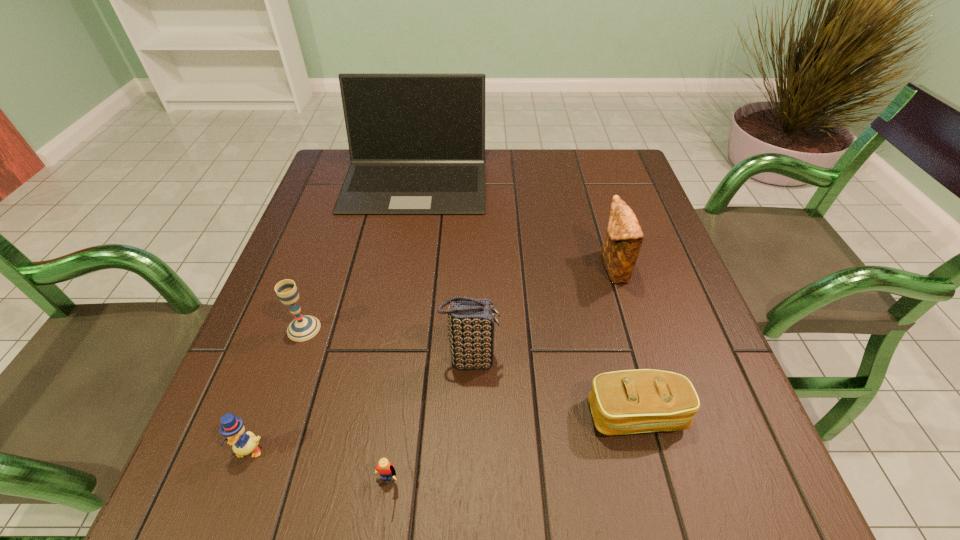
What are the coordinates of `the farthest object` in the screenshot? It's located at (416, 141).

The width and height of the screenshot is (960, 540). Find the location of `laptop`. laptop is located at coordinates (416, 141).

The height and width of the screenshot is (540, 960). I want to click on the fourth nearest object, so click(x=471, y=321).

You are a GUI agent. You are given a task and a screenshot of the screen. Output one action in this format:
    pyautogui.click(x=<x>, y=<y>)
    Task: Click on the leftmost clutch bag
    This screenshot has width=960, height=540.
    Given the screenshot: What is the action you would take?
    pyautogui.click(x=471, y=321)

At what (x,y) coordinates should I click in order to perform the action: click on the farthest clutch bag. Please return your answer as a coordinate pair (x, y). The image size is (960, 540). Looking at the image, I should click on (620, 250).

Locate an element on the screen. Image resolution: width=960 pixels, height=540 pixels. chalice is located at coordinates (302, 328).

At what (x,y) coordinates should I click in order to perform the action: click on the fifth nearest object. Please return your answer as a coordinate pair (x, y). Image resolution: width=960 pixels, height=540 pixels. Looking at the image, I should click on (302, 328).

Find the location of a particular element. Image resolution: width=960 pixels, height=540 pixels. duckling is located at coordinates (232, 427).

Identify the location of the nearest clutch bag. The height and width of the screenshot is (540, 960). (622, 402).

You are a GUI agent. You are given a task and a screenshot of the screen. Output one action in this format:
    pyautogui.click(x=<x>, y=<y>)
    Task: Click on the nearest object
    This screenshot has width=960, height=540.
    Given the screenshot: What is the action you would take?
    pyautogui.click(x=385, y=469)